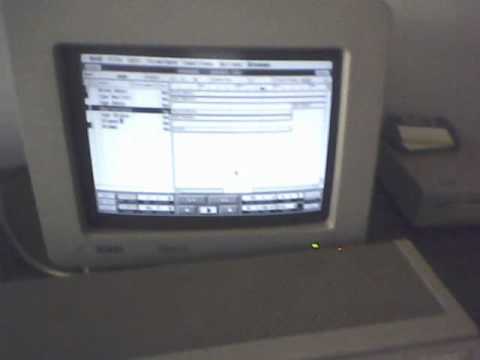
Find the location of a particular element. The image size is (480, 360). desk surface is located at coordinates [x=443, y=260].